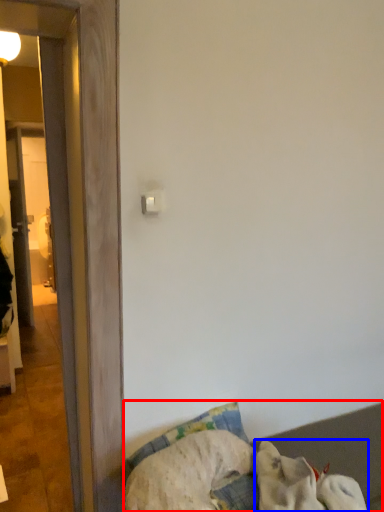
Question: Which of the following is the farthest to the observer, furniture (highlighted by a red box) or dog (highlighted by a blue box)?

Choices:
 (A) furniture
 (B) dog

Answer: (A)